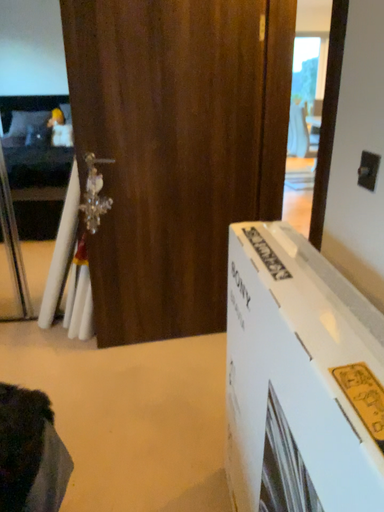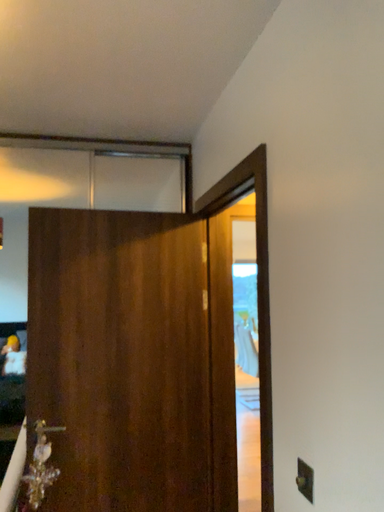
Question: Which way did the camera rotate in the video?

Choices:
 (A) rotated upward
 (B) rotated downward

Answer: (A)